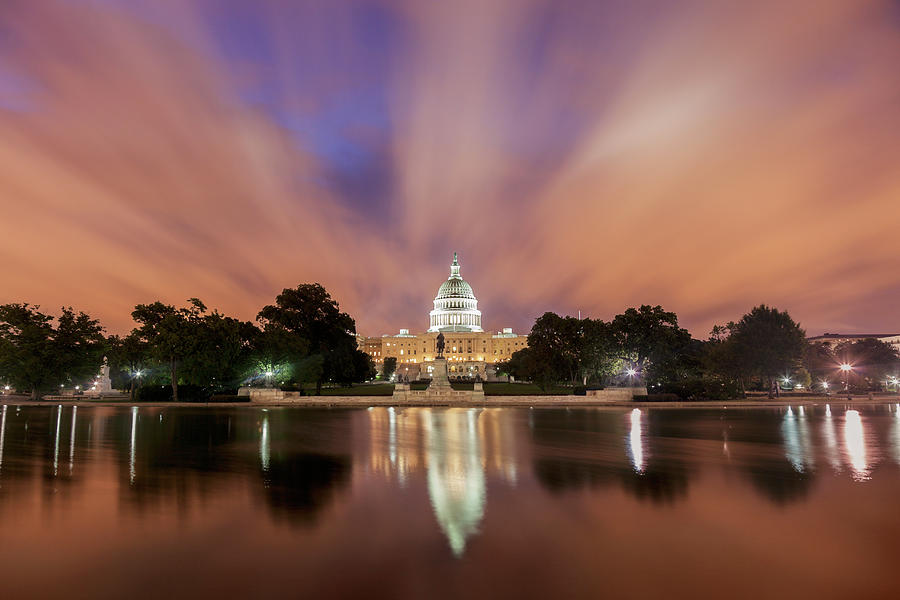
In order to click on light in this screenshot , I will do `click(785, 378)`.